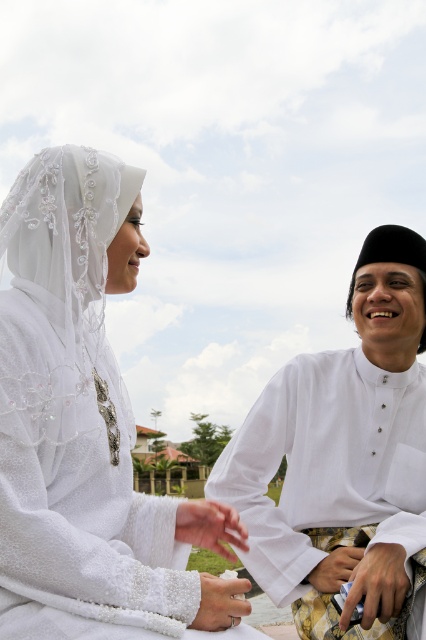
Can you confirm if smooth leather hand at center is shorter than white satin hand at center?

Yes, smooth leather hand at center is shorter than white satin hand at center.

Who is higher up, smooth leather hand at center or white satin hand at center?

Positioned higher is white satin hand at center.

The height and width of the screenshot is (640, 426). Identify the location of smooth leather hand at center. (377, 582).

Based on the photo, does white cotton shirt at right have a smaller size compared to silver metallic ring at center?

No.

What do you see at coordinates (344, 454) in the screenshot? I see `white cotton shirt at right` at bounding box center [344, 454].

Where is `white cotton shirt at right`? This screenshot has width=426, height=640. white cotton shirt at right is located at coordinates (344, 454).

Where is `white cotton shirt at right`? The image size is (426, 640). white cotton shirt at right is located at coordinates (344, 454).

What do you see at coordinates (344, 454) in the screenshot?
I see `white cotton shirt at right` at bounding box center [344, 454].

Which is in front, point (310, 458) or point (310, 580)?

Point (310, 580) is in front.

Does point (322, 486) come in front of point (324, 592)?

No, it is not.

In order to click on white cotton shirt at right in this screenshot , I will do `click(344, 454)`.